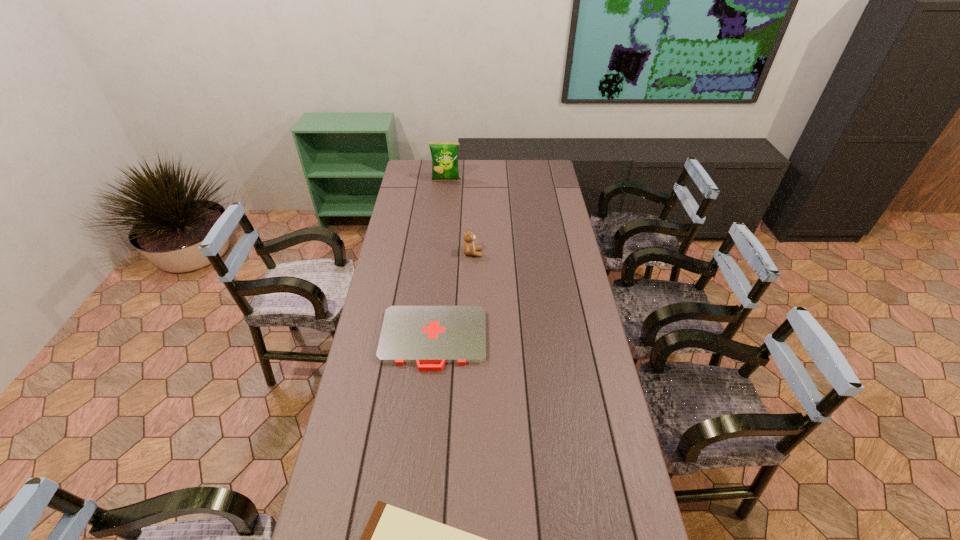
I want to click on crisp (potato chip) that is at the left edge, so click(444, 155).

Locate an element on the screen. the first-aid kit that is positioned at the left edge is located at coordinates (430, 336).

Where is `object at the far left corner`? The image size is (960, 540). object at the far left corner is located at coordinates (444, 155).

In the image, there is a desktop. Where is `free region at the left edge`? free region at the left edge is located at coordinates (402, 188).

At what (x,y) coordinates should I click in order to perform the action: click on vacant area at the right edge of the desktop. Please return your answer as a coordinate pair (x, y). The width and height of the screenshot is (960, 540). Looking at the image, I should click on (543, 190).

You are a GUI agent. You are given a task and a screenshot of the screen. Output one action in this format:
    pyautogui.click(x=<x>, y=<y>)
    Task: Click on the vacant space at the far right corner of the desktop
    The width and height of the screenshot is (960, 540).
    Given the screenshot: What is the action you would take?
    pyautogui.click(x=532, y=160)

I want to click on free spot between the crisp (potato chip) and the third shortest object, so click(x=459, y=217).

Identify the location of vacant point located between the second shortest object and the farthest object. (440, 260).

Where is `vacant space in between the teddy bear and the tallest object`? vacant space in between the teddy bear and the tallest object is located at coordinates (459, 217).

You are a GUI agent. You are given a task and a screenshot of the screen. Output one action in this format:
    pyautogui.click(x=<x>, y=<y>)
    Task: Click on the free space between the farthest object and the first-aid kit
    
    Given the screenshot: What is the action you would take?
    pyautogui.click(x=440, y=260)